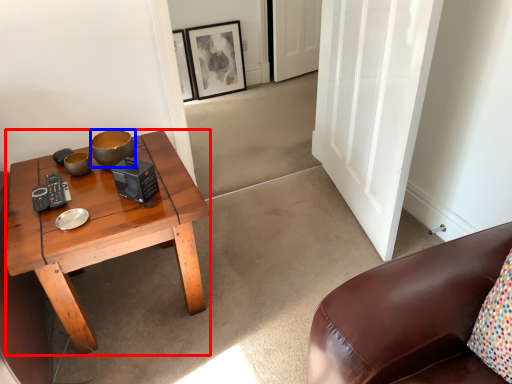
Question: Which point is closer to the camera, coffee table (highlighted by a red box) or bowl (highlighted by a blue box)?

Choices:
 (A) coffee table
 (B) bowl

Answer: (A)